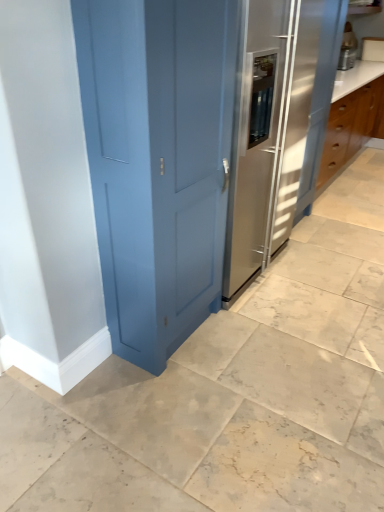
Question: From the image's perspective, is metallic silver appliance at upper right over satin stainless steel fridge at center?

Choices:
 (A) no
 (B) yes

Answer: (B)

Question: From the image's perspective, would you say metallic silver appliance at upper right is shown under satin stainless steel fridge at center?

Choices:
 (A) no
 (B) yes

Answer: (A)

Question: From a real-world perspective, is metallic silver appliance at upper right located beneath satin stainless steel fridge at center?

Choices:
 (A) yes
 (B) no

Answer: (B)

Question: Does metallic silver appliance at upper right have a lesser width compared to satin stainless steel fridge at center?

Choices:
 (A) no
 (B) yes

Answer: (B)

Question: Does metallic silver appliance at upper right have a larger size compared to satin stainless steel fridge at center?

Choices:
 (A) no
 (B) yes

Answer: (A)

Question: Is metallic silver appliance at upper right not inside satin stainless steel fridge at center?

Choices:
 (A) yes
 (B) no

Answer: (A)

Question: Is metallic silver appliance at upper right at the back of satin stainless steel fridge at center?

Choices:
 (A) no
 (B) yes

Answer: (A)

Question: Is satin stainless steel fridge at center positioned before metallic silver appliance at upper right?

Choices:
 (A) no
 (B) yes

Answer: (B)

Question: Does satin stainless steel fridge at center come behind metallic silver appliance at upper right?

Choices:
 (A) no
 (B) yes

Answer: (A)

Question: Is satin stainless steel fridge at center thinner than metallic silver appliance at upper right?

Choices:
 (A) no
 (B) yes

Answer: (A)

Question: From a real-world perspective, is satin stainless steel fridge at center on metallic silver appliance at upper right?

Choices:
 (A) yes
 (B) no

Answer: (B)

Question: Does satin stainless steel fridge at center touch metallic silver appliance at upper right?

Choices:
 (A) yes
 (B) no

Answer: (B)

Question: From a real-world perspective, is satin stainless steel fridge at center positioned above or below metallic silver appliance at upper right?

Choices:
 (A) below
 (B) above

Answer: (A)